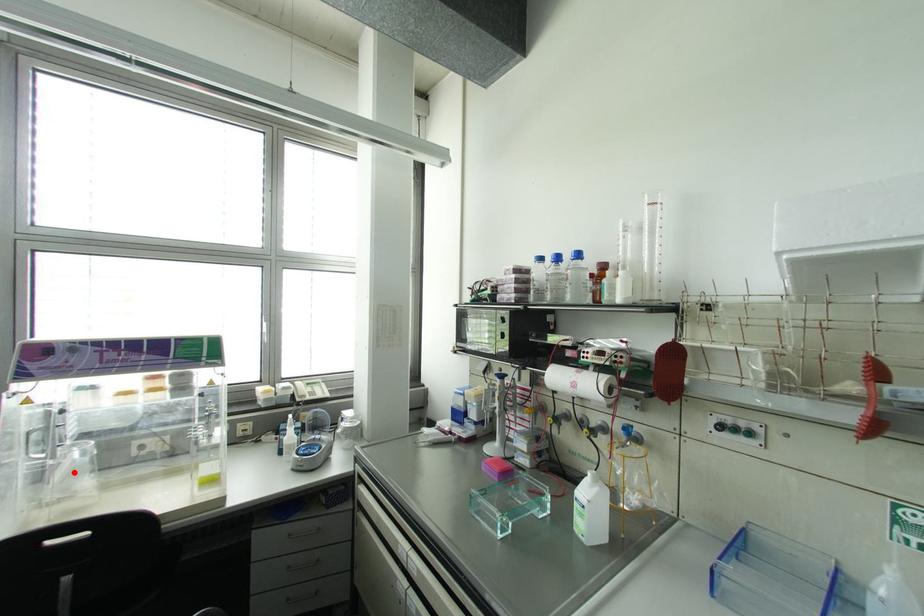
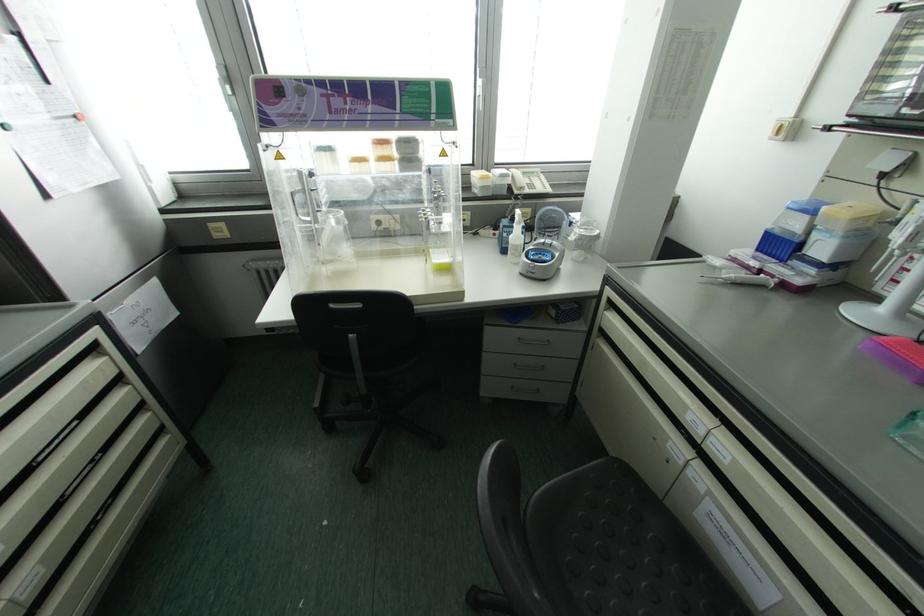
Question: I am providing you with two images of the same scene from different viewpoints. A red point is shown in image1. For the corresponding object point in image2, is it positioned nearer or farther from the camera?

Choices:
 (A) Nearer
 (B) Farther

Answer: (B)